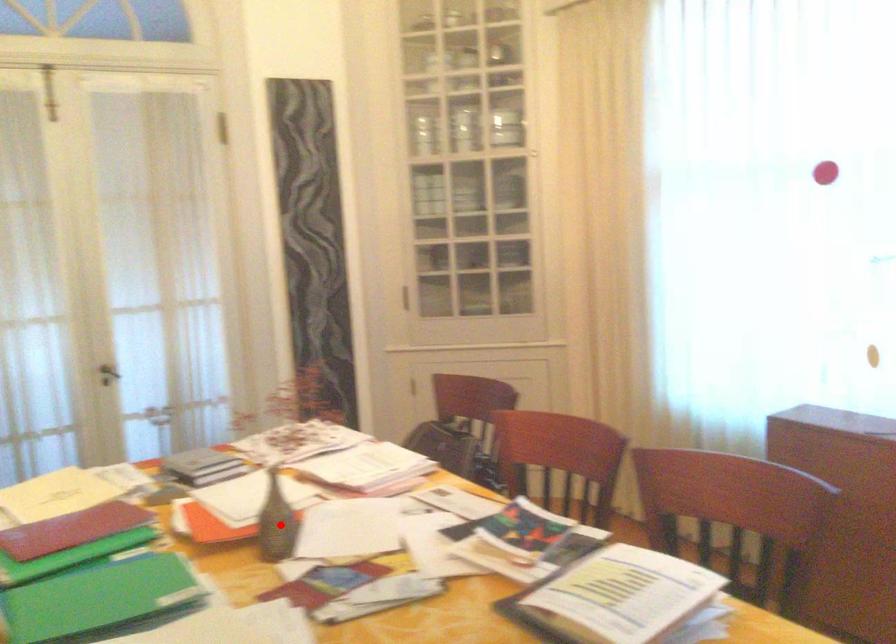
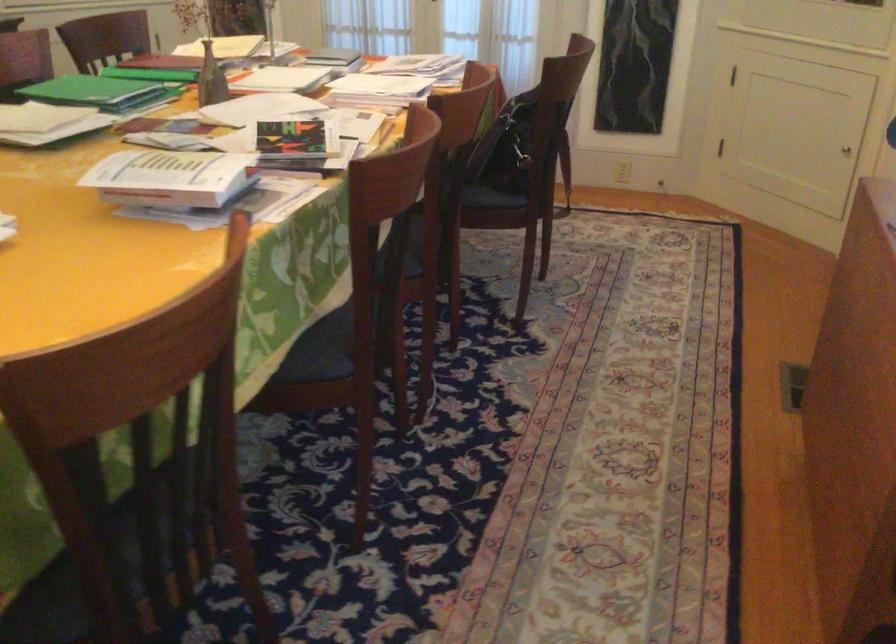
The point at the highlighted location is marked in the first image. Where is the corresponding point in the second image?

(211, 79)